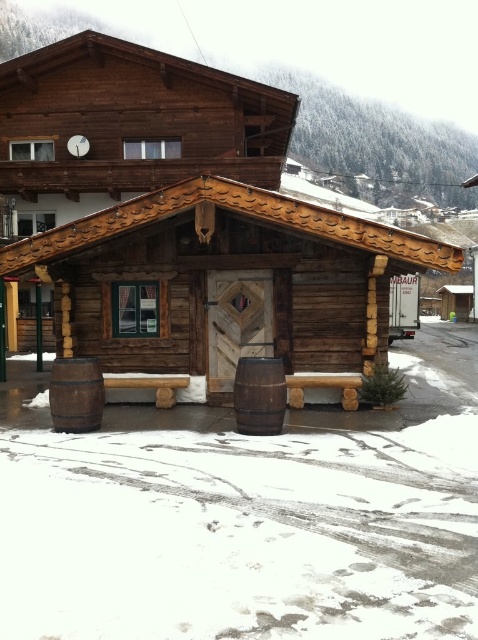
You are a delivery person trying to park your truck in front of the wooden cabin at center. The brown wooden barrel at lower left is in the way. Can you estimate if the cabin is big enough to move the barrel aside to make space for parking?

The wooden cabin at center is larger in size than brown wooden barrel at lower left, but the cabin itself is a structure and cannot be moved. The brown wooden barrel at lower left is smaller and can be moved aside to create space for parking the truck.

You are a delivery person trying to determine if your 2.5 meter tall box can fit through the entrance of the wooden cabin at center. Considering the height of the brown wooden barrel at lower left, can you estimate if the box will fit?

The wooden cabin at center has a greater height compared to the brown wooden barrel at lower left. Since the barrel is shorter than the cabin, but we don not know the exact height of the cabin entrance, it is uncertain if the 2.5 meter tall box will fit. Additional information about the cabin entrance height is needed.

You are a delivery person trying to place a new wooden barrel in front of the chalet. The existing barrels are the brown wooden barrel at lower center and the brown wooden barrel at lower left. Which existing barrel should you use as a reference for width to ensure the new barrel fits in the space between them?

The brown wooden barrel at lower left is wider, so using it as a reference ensures the new barrel will fit between the two existing barrels.